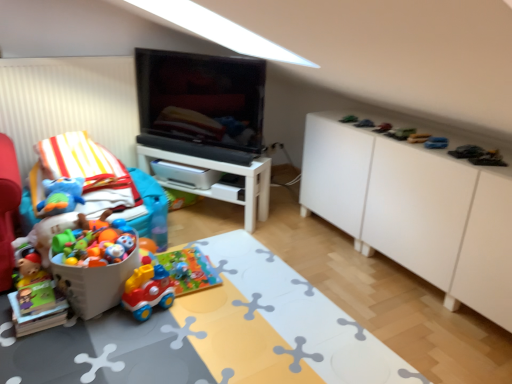
Measure the distance between plastic toy car at upper right, positioned as the first toy in right-to-left order, and camera.

They are 5.94 feet apart.

This screenshot has height=384, width=512. Describe the element at coordinates (94, 284) in the screenshot. I see `white plastic bucket at lower left` at that location.

Where is `rubber duck at upper right, the eighth toy when ordered from left to right`? rubber duck at upper right, the eighth toy when ordered from left to right is located at coordinates (418, 138).

In order to click on white glossy table at center, the 1th table in the front-to-back sequence in this screenshot , I will do `click(213, 335)`.

The image size is (512, 384). What do you see at coordinates (147, 291) in the screenshot?
I see `rubberized plastic train at center, which is the 9th toy from right to left` at bounding box center [147, 291].

At what (x,y) coordinates should I click in order to perform the action: click on plastic toy car at upper right, arranged as the eleventh toy when viewed from the left. Please return your answer as a coordinate pair (x, y). This screenshot has height=384, width=512. Looking at the image, I should click on (478, 155).

Is black glossy tv at center inside or outside of white glossy table at center, the second table viewed from the back?

black glossy tv at center is spatially situated outside white glossy table at center, the second table viewed from the back.

Can you see black glossy tv at center touching white glossy table at center, the 1th table in the bottom-to-top sequence?

No, black glossy tv at center is not with white glossy table at center, the 1th table in the bottom-to-top sequence.

Is black glossy tv at center taller or shorter than white glossy table at center, the 1th table in the bottom-to-top sequence?

black glossy tv at center is taller than white glossy table at center, the 1th table in the bottom-to-top sequence.

From a real-world perspective, is black glossy tv at center positioned over white glossy table at center, which appears as the 2th table when viewed from the top, based on gravity?

Yes, from a real-world perspective, black glossy tv at center is on top of white glossy table at center, which appears as the 2th table when viewed from the top.

Is green plastic toy car at upper right, the seventh toy in the left-to-right sequence, far away from green plastic toy at upper right, arranged as the 8th toy when viewed from the right?

That's not correct — green plastic toy car at upper right, the seventh toy in the left-to-right sequence, is a little close to green plastic toy at upper right, arranged as the 8th toy when viewed from the right.

Considering the sizes of objects green plastic toy car at upper right, which is counted as the 5th toy, starting from the right, and green plastic toy at upper right, which is the 4th toy in left-to-right order, in the image provided, who is shorter, green plastic toy car at upper right, which is counted as the 5th toy, starting from the right, or green plastic toy at upper right, which is the 4th toy in left-to-right order,?

Standing shorter between the two is green plastic toy at upper right, which is the 4th toy in left-to-right order.

From the image's perspective, who appears lower, green plastic toy car at upper right, which is counted as the 5th toy, starting from the right, or green plastic toy at upper right, which is the 4th toy in left-to-right order?

green plastic toy car at upper right, which is counted as the 5th toy, starting from the right, from the image's perspective.

Which is behind, point (402, 137) or point (339, 121)?

The point (339, 121) is farther.

Where is `the 1st toy to the right of the white glossy table at center, the 1th table in the bottom-to-top sequence, counting from the anchor's position`? Image resolution: width=512 pixels, height=384 pixels. the 1st toy to the right of the white glossy table at center, the 1th table in the bottom-to-top sequence, counting from the anchor's position is located at coordinates coord(349,119).

Which object is positioned more to the right, white glossy table at center, which appears as the 2th table when viewed from the top, or green plastic toy at upper right, which is the 4th toy in left-to-right order?

green plastic toy at upper right, which is the 4th toy in left-to-right order, is more to the right.

Consider the image. How different are the orientations of white glossy table at center, the 1th table in the front-to-back sequence, and green plastic toy at upper right, which is the 4th toy in left-to-right order, in degrees?

white glossy table at center, the 1th table in the front-to-back sequence, and green plastic toy at upper right, which is the 4th toy in left-to-right order, are facing 103 degrees away from each other.

From the picture: Is white glossy table at center, which appears as the 2th table when viewed from the top, shorter than green plastic toy at upper right, arranged as the 8th toy when viewed from the right?

No.

Between white glossy table at center, the second table viewed from the back, and rubber car at upper right, which is the fifth toy from left to right, which one is positioned behind?

rubber car at upper right, which is the fifth toy from left to right, is behind.

Which is in front, point (200, 317) or point (361, 124)?

The point (200, 317) is in front.

Can you confirm if white glossy table at center, which appears as the 2th table when viewed from the top, is bigger than rubber car at upper right, placed as the 7th toy when sorted from right to left?

Correct, white glossy table at center, which appears as the 2th table when viewed from the top, is larger in size than rubber car at upper right, placed as the 7th toy when sorted from right to left.

Can you tell me how much soft plush toy at left, the 1th toy from the left, and white glossy table at center, positioned as the 1th table in top-to-bottom order, differ in facing direction?

There is a 45.6-degree angle between the facing directions of soft plush toy at left, the 1th toy from the left, and white glossy table at center, positioned as the 1th table in top-to-bottom order.

Looking at this image, would you say soft plush toy at left, the 1th toy from the left, is to the left or to the right of white glossy table at center, placed as the 2th table when sorted from front to back, in the picture?

soft plush toy at left, the 1th toy from the left, is to the left of white glossy table at center, placed as the 2th table when sorted from front to back.

Which point is more forward, (69, 190) or (151, 155)?

Point (69, 190)

Is soft plush toy at left, the 11th toy in the right-to-left sequence, oriented away from white glossy table at center, positioned as the 2th table in bottom-to-top order?

No, white glossy table at center, positioned as the 2th table in bottom-to-top order, is not at the back of soft plush toy at left, the 11th toy in the right-to-left sequence.

From a real-world perspective, which is physically below, green plastic toy car at upper right, which is counted as the 5th toy, starting from the right, or rubber car at upper right, which is the fifth toy from left to right?

rubber car at upper right, which is the fifth toy from left to right, from a real-world perspective.

Does green plastic toy car at upper right, which is counted as the 5th toy, starting from the right, have a greater height compared to rubber car at upper right, which is the fifth toy from left to right?

Indeed, green plastic toy car at upper right, which is counted as the 5th toy, starting from the right, has a greater height compared to rubber car at upper right, which is the fifth toy from left to right.

Which toy is the 2nd one when counting from the left side of the green plastic toy car at upper right, the seventh toy in the left-to-right sequence? Please provide its 2D coordinates.

[(364, 123)]

Is green plastic toy car at upper right, which is counted as the 5th toy, starting from the right, situated inside rubber car at upper right, which is the fifth toy from left to right, or outside?

green plastic toy car at upper right, which is counted as the 5th toy, starting from the right, is located beyond the bounds of rubber car at upper right, which is the fifth toy from left to right.

Is white matte cabinet at right smaller than rubberized plastic train at center, which is the 9th toy from right to left?

No, white matte cabinet at right is not smaller than rubberized plastic train at center, which is the 9th toy from right to left.

Do you think white matte cabinet at right is within rubberized plastic train at center, which appears as the 3th toy when viewed from the left, or outside of it?

white matte cabinet at right exists outside the volume of rubberized plastic train at center, which appears as the 3th toy when viewed from the left.

Consider the image. Is white matte cabinet at right at the left side of rubberized plastic train at center, which is the 9th toy from right to left?

No.

Is white matte cabinet at right further to the viewer compared to rubberized plastic train at center, which appears as the 3th toy when viewed from the left?

No, it is in front of rubberized plastic train at center, which appears as the 3th toy when viewed from the left.

Locate an element on the screen. entertainment center behind the white glossy table at center, the second table viewed from the back is located at coordinates (205, 118).

At what (x,y) coordinates should I click in order to perform the action: click on the 3rd toy in front when counting from the green plastic toy at upper right, which is the 4th toy in left-to-right order. Please return your answer as a coordinate pair (x, y). Looking at the image, I should click on (400, 133).

Based on their spatial positions, is metallic silver toy car at upper right, which is the sixth toy in right-to-left order, or white glossy table at center, the 1th table in the bottom-to-top sequence, closer to rubberized plastic train at center, which appears as the 3th toy when viewed from the left?

white glossy table at center, the 1th table in the bottom-to-top sequence.

Which object lies nearer to the anchor point white glossy table at center, positioned as the 1th table in back-to-front order, soft plush toy at left, the 1th toy from the left, or rubber car at upper right, placed as the 7th toy when sorted from right to left?

Based on the image, soft plush toy at left, the 1th toy from the left, appears to be nearer to white glossy table at center, positioned as the 1th table in back-to-front order.

From the image, which object appears to be nearer to green plastic toy car at upper right, which is counted as the 5th toy, starting from the right, rubberized plastic train at center, which is the 9th toy from right to left, or metallic silver toy car at upper right, which is the sixth toy in right-to-left order?

metallic silver toy car at upper right, which is the sixth toy in right-to-left order, is positioned closer to the anchor green plastic toy car at upper right, which is counted as the 5th toy, starting from the right.

When comparing their distances from white matte cabinet at right, does white glossy table at center, placed as the 2th table when sorted from front to back, or rubberized plastic train at center, which appears as the 3th toy when viewed from the left, seem closer?

Among the two, white glossy table at center, placed as the 2th table when sorted from front to back, is located nearer to white matte cabinet at right.

Estimate the real-world distances between objects in this image. Which object is further from plastic toy car at upper right, arranged as the eleventh toy when viewed from the left, black glossy tv at center or dark green fabric toy at upper right, which ranks as the tenth toy in left-to-right order?

black glossy tv at center is positioned further to the anchor plastic toy car at upper right, arranged as the eleventh toy when viewed from the left.

Looking at the image, which one is located closer to rubber car at upper right, which is the fifth toy from left to right, dark green fabric toy at upper right, arranged as the 2th toy when viewed from the right, or blue rubber toy at upper right, which is the third toy from right to left?

blue rubber toy at upper right, which is the third toy from right to left, is positioned closer to the anchor rubber car at upper right, which is the fifth toy from left to right.

When comparing their distances from dark green fabric toy at upper right, arranged as the 2th toy when viewed from the right, does green plastic toy at upper right, which is the 4th toy in left-to-right order, or black glossy tv at center seem further?

Among the two, black glossy tv at center is located further to dark green fabric toy at upper right, arranged as the 2th toy when viewed from the right.

Considering their positions, is white matte cabinet at right positioned further to blue rubber toy at upper right, which is the third toy from right to left, than dark green fabric toy at upper right, which ranks as the tenth toy in left-to-right order?

Result: Based on the image, white matte cabinet at right appears to be further to blue rubber toy at upper right, which is the third toy from right to left.

Identify the location of cabinetry between white glossy table at center, positioned as the 2th table in bottom-to-top order, and blue rubber toy at upper right, which is the third toy from right to left, from left to right. (415, 210).

Find the location of a particular element. toy situated between white glossy table at center, positioned as the 2th table in bottom-to-top order, and rubber car at upper right, which is the fifth toy from left to right, from left to right is located at coordinates (349, 119).

This screenshot has height=384, width=512. Find the location of `entertainment center between rubberized plastic train at center, which appears as the 3th toy when viewed from the left, and green plastic toy car at upper right, the seventh toy in the left-to-right sequence, from left to right`. entertainment center between rubberized plastic train at center, which appears as the 3th toy when viewed from the left, and green plastic toy car at upper right, the seventh toy in the left-to-right sequence, from left to right is located at coordinates (205, 118).

The height and width of the screenshot is (384, 512). In order to click on toy between rubberized plastic train at center, which appears as the 3th toy when viewed from the left, and rubber car at upper right, placed as the 7th toy when sorted from right to left, in the horizontal direction in this screenshot , I will do `click(349, 119)`.